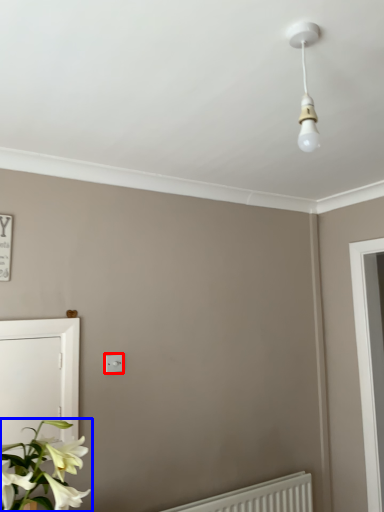
Question: Which of the following is the farthest to the observer, light switch (highlighted by a red box) or houseplant (highlighted by a blue box)?

Choices:
 (A) light switch
 (B) houseplant

Answer: (A)